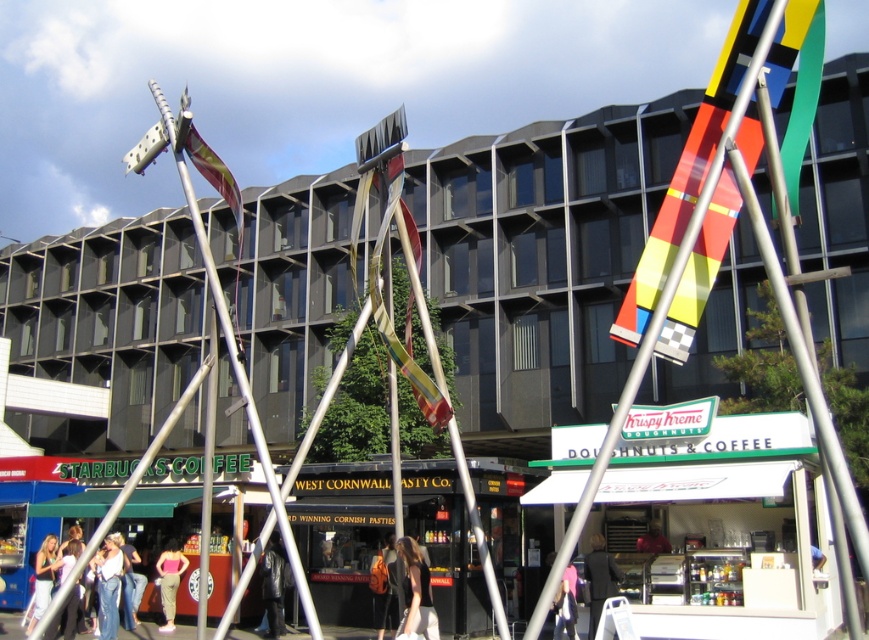
Question: Can you confirm if matte pink top at center is positioned to the left of denim pants at lower left?

Choices:
 (A) yes
 (B) no

Answer: (B)

Question: Is shiny metallic flag at upper left to the left of pink fabric at lower center from the viewer's perspective?

Choices:
 (A) no
 (B) yes

Answer: (B)

Question: Can you confirm if leather jacket at center is positioned to the left of dark gray jacket at center?

Choices:
 (A) no
 (B) yes

Answer: (B)

Question: Which object is positioned farthest from the pink fabric at lower center?

Choices:
 (A) dark brown leather jacket at center
 (B) shiny metallic flag at upper left
 (C) denim pants at lower left
 (D) multicolored fabric banner at center

Answer: (B)

Question: Which object is positioned farthest from the multicolored fabric banner at center?

Choices:
 (A) pink fabric at lower center
 (B) red shirt at center
 (C) denim jeans at lower left

Answer: (C)

Question: Which point appears closest to the camera in this image?

Choices:
 (A) (98, 634)
 (B) (171, 621)

Answer: (A)